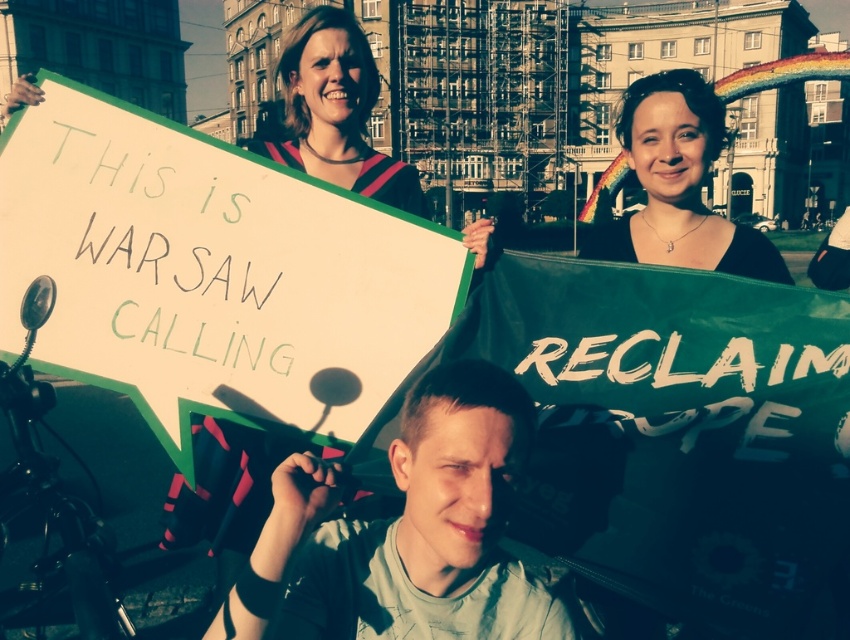
Question: Which point appears closest to the camera in this image?

Choices:
 (A) (414, 432)
 (B) (355, 390)
 (C) (732, 257)

Answer: (A)

Question: Estimate the real-world distances between objects in this image. Which object is closer to the light gray cotton shirt at center?

Choices:
 (A) matte black hair at upper center
 (B) white paper sign at upper left

Answer: (B)

Question: Does white paper sign at upper left come in front of matte black hair at upper center?

Choices:
 (A) yes
 (B) no

Answer: (A)

Question: Is white paper sign at upper left behind light gray cotton shirt at center?

Choices:
 (A) no
 (B) yes

Answer: (B)

Question: Which is nearer to the matte black hair at upper center?

Choices:
 (A) white paper sign at upper left
 (B) light gray cotton shirt at center

Answer: (A)

Question: Is white paper sign at upper left wider than light gray cotton shirt at center?

Choices:
 (A) no
 (B) yes

Answer: (B)